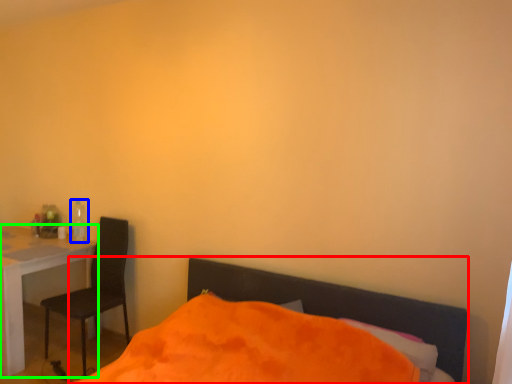
Question: Based on their relative distances, which object is farther from bed (highlighted by a red box)? Choose from bottle (highlighted by a blue box) and desk (highlighted by a green box).

Choices:
 (A) bottle
 (B) desk

Answer: (A)